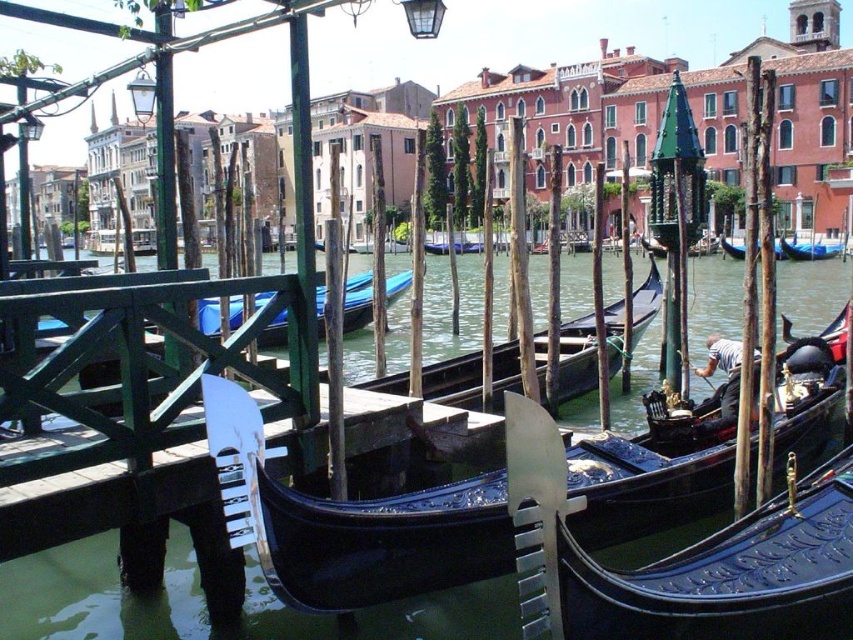
Which is behind, point (724, 609) or point (432, 244)?

The point (432, 244) is behind.

Who is lower down, black polished wood gondola at center or blue glossy boat at center?

Positioned lower is black polished wood gondola at center.

Does point (572, 605) come closer to viewer compared to point (463, 250)?

Yes, point (572, 605) is closer to viewer.

Where is `black polished wood gondola at center`? The width and height of the screenshot is (853, 640). black polished wood gondola at center is located at coordinates (691, 566).

Between shiny black gondola at center and black polished wood gondola at center, which one is positioned lower?

Positioned lower is black polished wood gondola at center.

Who is positioned more to the right, shiny black gondola at center or black polished wood gondola at center?

From the viewer's perspective, shiny black gondola at center appears more on the right side.

Is point (680, 461) behind point (521, 600)?

Yes, it is.

Find the location of a particular element. The height and width of the screenshot is (640, 853). shiny black gondola at center is located at coordinates (363, 529).

Measure the distance between point (660, 570) and camera.

A distance of 35.10 meters exists between point (660, 570) and camera.

What do you see at coordinates (691, 566) in the screenshot? This screenshot has height=640, width=853. I see `black polished wood gondola at center` at bounding box center [691, 566].

Where is `black polished wood gondola at center`? black polished wood gondola at center is located at coordinates (691, 566).